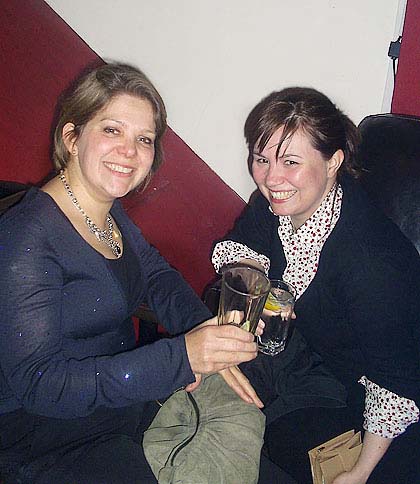
Where is `wall`? This screenshot has width=420, height=484. wall is located at coordinates (180, 59).